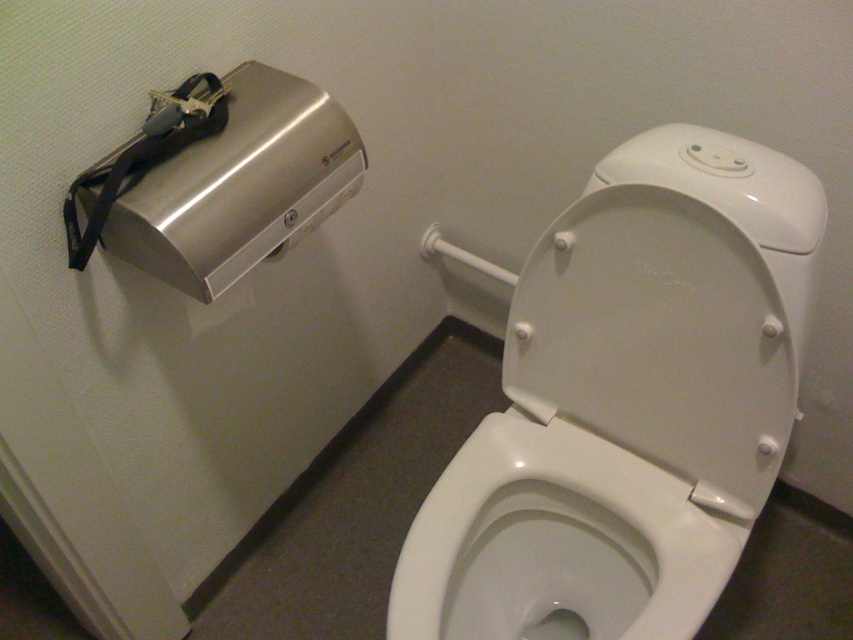
Between point (723, 525) and point (199, 205), which one is positioned in front?

Point (199, 205)

Does white glossy toilet bowl at center have a smaller size compared to satin silver hand dryer at upper left?

Incorrect, white glossy toilet bowl at center is not smaller in size than satin silver hand dryer at upper left.

Which is behind, point (485, 451) or point (115, 193)?

The point (485, 451) is behind.

Image resolution: width=853 pixels, height=640 pixels. Find the location of `white glossy toilet bowl at center`. white glossy toilet bowl at center is located at coordinates (556, 544).